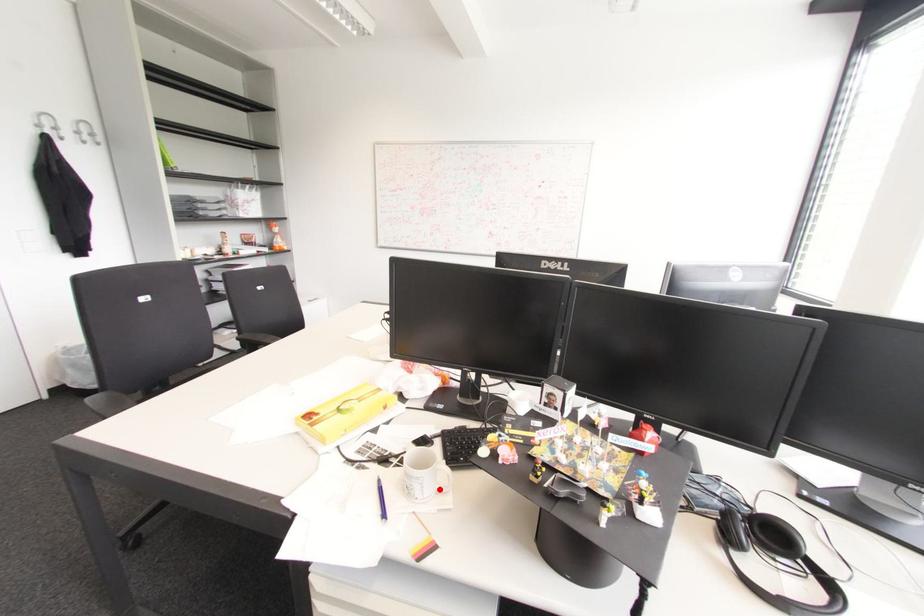
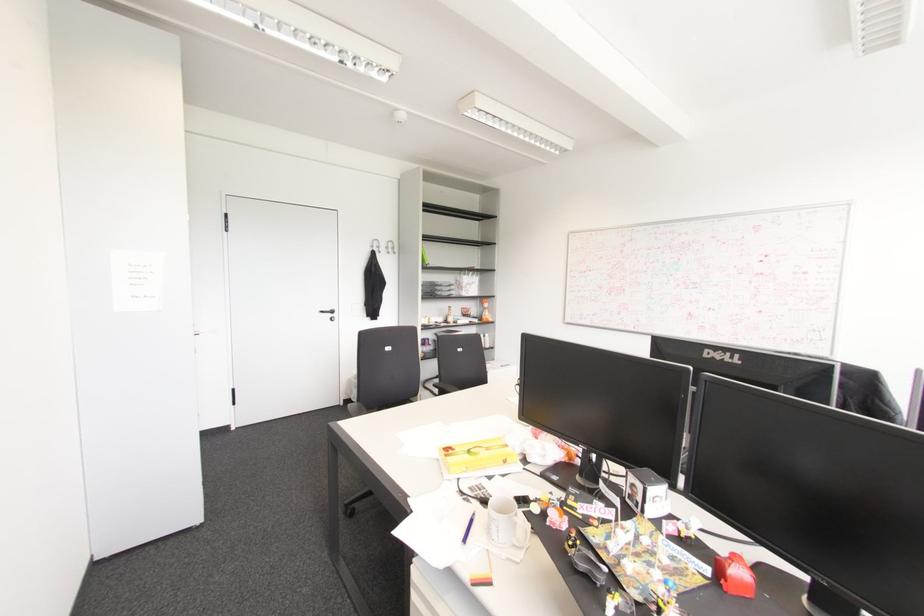
Find the pixel in the second image that matches the highlighted location in the first image.

(515, 543)